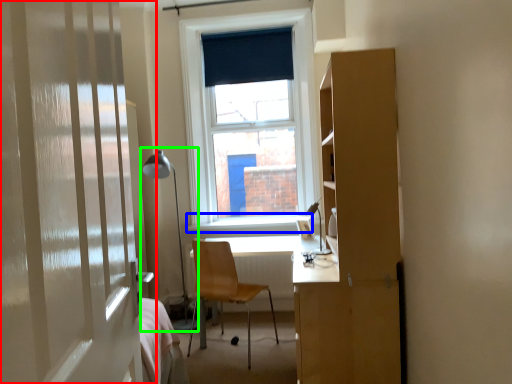
Question: Which is farther away from door (highlighted by a red box)? window sill (highlighted by a blue box) or table lamp (highlighted by a green box)?

Choices:
 (A) window sill
 (B) table lamp

Answer: (A)